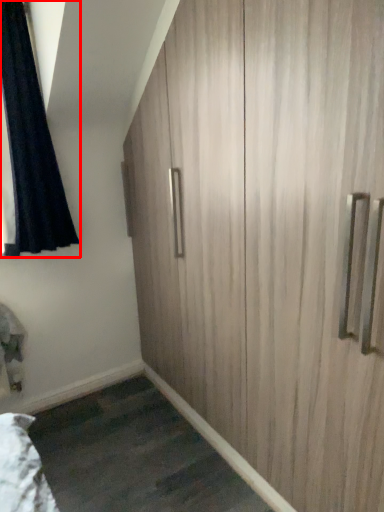
Question: From the image's perspective, considering the relative positions of curtain (annotated by the red box) and cupboard in the image provided, where is curtain (annotated by the red box) located with respect to the staircase?

Choices:
 (A) above
 (B) below

Answer: (A)